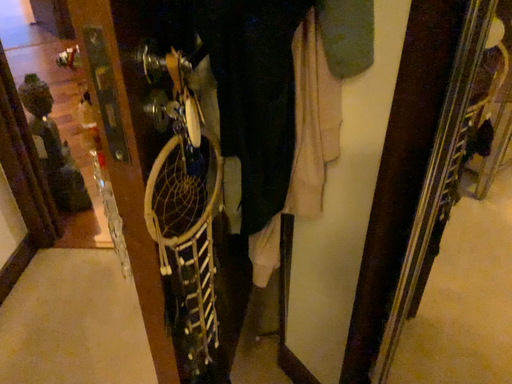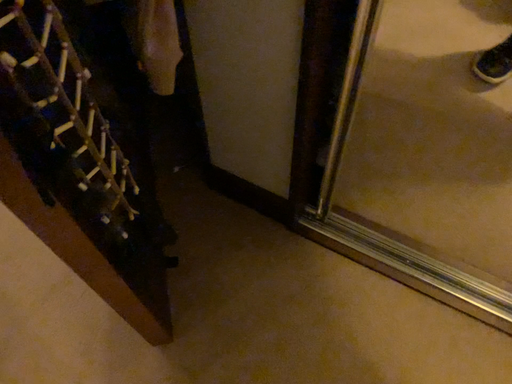
Question: Which way did the camera rotate in the video?

Choices:
 (A) rotated left
 (B) rotated right

Answer: (B)